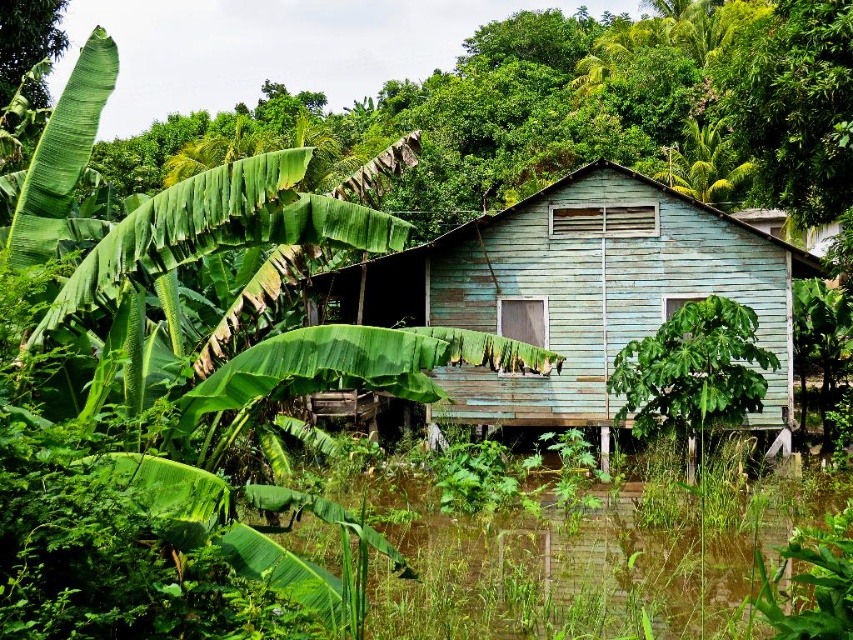
Which of these two, light blue wooden hut at center or green leafy plant at center, stands taller?

Standing taller between the two is green leafy plant at center.

Which is above, light blue wooden hut at center or green leafy plant at center?

Positioned higher is green leafy plant at center.

I want to click on light blue wooden hut at center, so click(579, 291).

Does point (49, 436) come closer to viewer compared to point (730, 220)?

That is True.

Does point (338, 205) come farther from viewer compared to point (445, 282)?

No, (338, 205) is in front of (445, 282).

Which is behind, point (99, 484) or point (610, 316)?

Point (610, 316)

This screenshot has width=853, height=640. What are the coordinates of `green leafy banana tree at left` in the screenshot? It's located at (161, 384).

Can you confirm if green leafy banana tree at left is positioned below green leafy plant at center?

No.

Can you confirm if green leafy banana tree at left is smaller than green leafy plant at center?

Yes.

I want to click on green leafy banana tree at left, so click(161, 384).

This screenshot has height=640, width=853. Identify the location of green leafy banana tree at left. (161, 384).